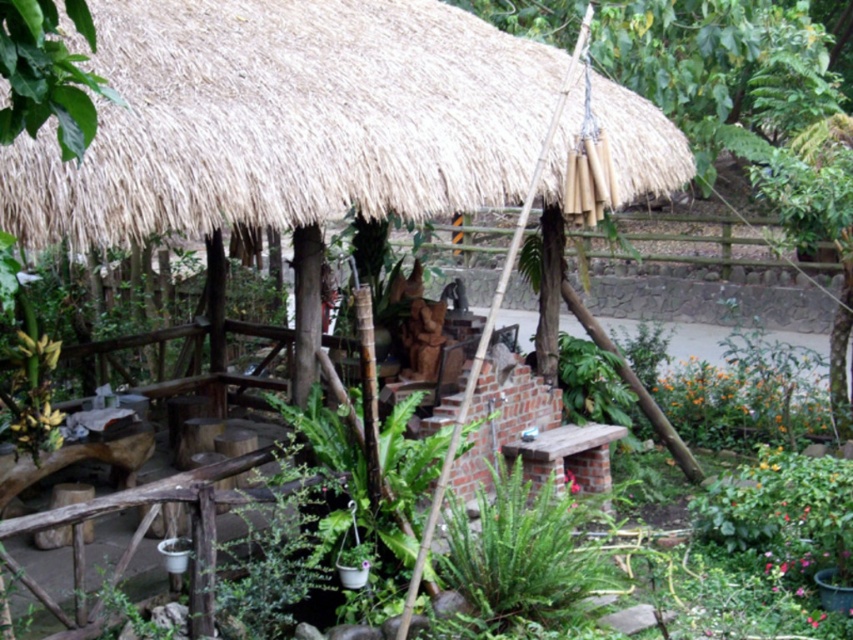
Question: Considering the relative positions of natural thatch roof at upper center and green leafy plant at center in the image provided, where is natural thatch roof at upper center located with respect to green leafy plant at center?

Choices:
 (A) left
 (B) right

Answer: (A)

Question: Which point is farther to the camera?

Choices:
 (A) green leafy plant at center
 (B) natural thatch roof at upper center

Answer: (A)

Question: Is natural thatch roof at upper center above green leafy plant at center?

Choices:
 (A) no
 (B) yes

Answer: (B)

Question: Which point is closer to the camera?

Choices:
 (A) (601, 586)
 (B) (491, 42)

Answer: (A)

Question: Observing the image, what is the correct spatial positioning of natural thatch roof at upper center in reference to green leafy plant at center?

Choices:
 (A) above
 (B) below

Answer: (A)